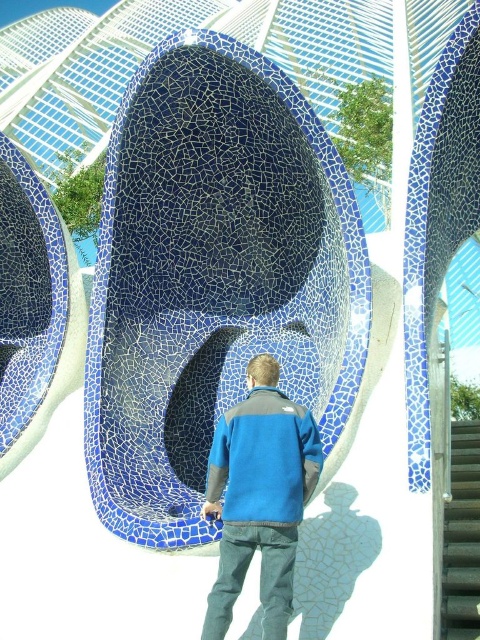
Question: Which object is the closest to the blue matte jacket at center?

Choices:
 (A) gray textured stair at center
 (B) blue fleece sweatshirt at center
 (C) blue mosaic bench at center

Answer: (B)

Question: Considering the relative positions of blue fleece sweatshirt at center and gray textured stair at center in the image provided, where is blue fleece sweatshirt at center located with respect to gray textured stair at center?

Choices:
 (A) above
 (B) below

Answer: (A)

Question: Which object appears farthest from the camera in this image?

Choices:
 (A) blue matte jacket at center
 (B) blue fleece sweatshirt at center
 (C) gray textured stair at center

Answer: (C)

Question: Is blue fleece sweatshirt at center below gray textured stair at center?

Choices:
 (A) no
 (B) yes

Answer: (A)

Question: Estimate the real-world distances between objects in this image. Which object is closer to the blue fleece sweatshirt at center?

Choices:
 (A) blue mosaic bench at center
 (B) blue matte jacket at center

Answer: (B)

Question: Is blue fleece sweatshirt at center wider than gray textured stair at center?

Choices:
 (A) no
 (B) yes

Answer: (A)